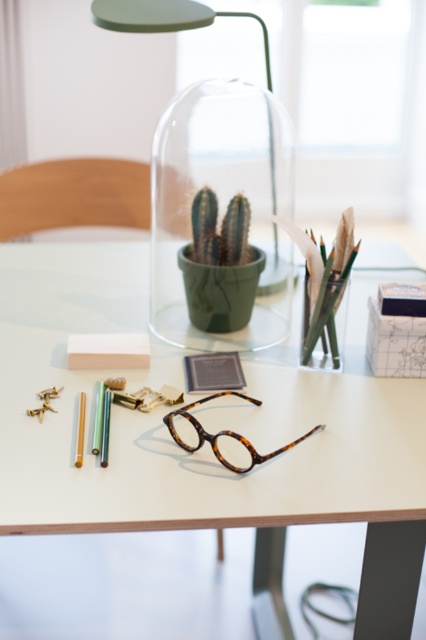
Looking at this image, is green matte lampshade at center positioned before tortoiseshell glasses at center?

No.

Which is more to the left, green matte lampshade at center or tortoiseshell glasses at center?

Positioned to the left is green matte lampshade at center.

Is point (169, 236) closer to viewer compared to point (235, 449)?

No, (169, 236) is further to viewer.

Where is `green matte lampshade at center`? This screenshot has height=640, width=426. green matte lampshade at center is located at coordinates (215, 180).

Does point (218, 438) lie behind point (77, 465)?

Yes, it is.

Which is in front, point (187, 445) or point (78, 445)?

Point (78, 445)

The height and width of the screenshot is (640, 426). I want to click on tortoiseshell glasses at center, so click(221, 436).

Is tortoiseshell eyeglasses at center positioned in front of pastel green matte crayon at lower left?

Yes, it is in front of pastel green matte crayon at lower left.

From the picture: Who is more forward, (259, 544) or (78, 417)?

Point (78, 417) is more forward.

Does point (121, 248) come closer to viewer compared to point (77, 426)?

No, it is not.

What are the coordinates of `tortoiseshell eyeglasses at center` in the screenshot? It's located at (172, 440).